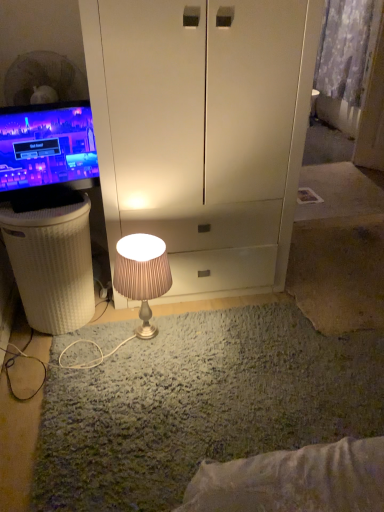
Question: From their relative heights in the image, would you say satin beige lamp at center is taller or shorter than patterned fabric curtain at upper right?

Choices:
 (A) tall
 (B) short

Answer: (B)

Question: Visually, is satin beige lamp at center positioned to the left or to the right of patterned fabric curtain at upper right?

Choices:
 (A) left
 (B) right

Answer: (A)

Question: Based on their relative distances, which object is nearer to the satin beige lamp at center?

Choices:
 (A) patterned fabric curtain at upper right
 (B) white wicker basket at left
 (C) matte black monitor at left

Answer: (B)

Question: Considering the real-world distances, which object is closest to the satin beige lamp at center?

Choices:
 (A) white wicker basket at left
 (B) patterned fabric curtain at upper right
 (C) matte black monitor at left

Answer: (A)